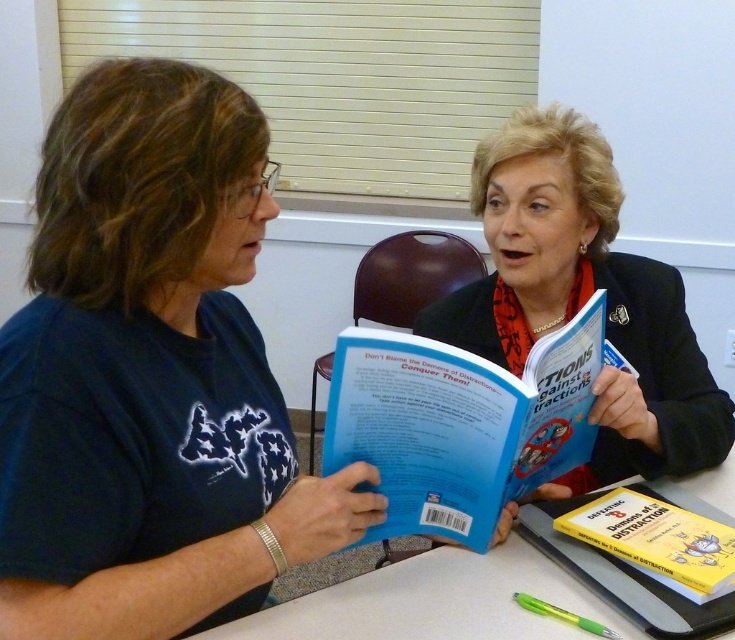
Between point (409, 612) and point (681, 512), which one is positioned in front?

Positioned in front is point (409, 612).

Locate an element on the screen. This screenshot has width=735, height=640. white plastic table at center is located at coordinates (434, 602).

Which is in front, point (686, 484) or point (645, 547)?

Point (645, 547) is in front.

Image resolution: width=735 pixels, height=640 pixels. Find the location of `white plastic table at center`. white plastic table at center is located at coordinates (434, 602).

Who is more distant from viewer, (68,572) or (442,410)?

Point (442,410)

Can you confirm if blue fabric shirt at left is positioned to the left of blue paperback book at center?

Indeed, blue fabric shirt at left is positioned on the left side of blue paperback book at center.

The height and width of the screenshot is (640, 735). In order to click on blue fabric shirt at left in this screenshot , I will do `click(150, 374)`.

Looking at this image, is matte black jacket at center bigger than white plastic table at center?

Yes, matte black jacket at center is bigger than white plastic table at center.

The height and width of the screenshot is (640, 735). Find the location of `matte black jacket at center`. matte black jacket at center is located at coordinates (584, 300).